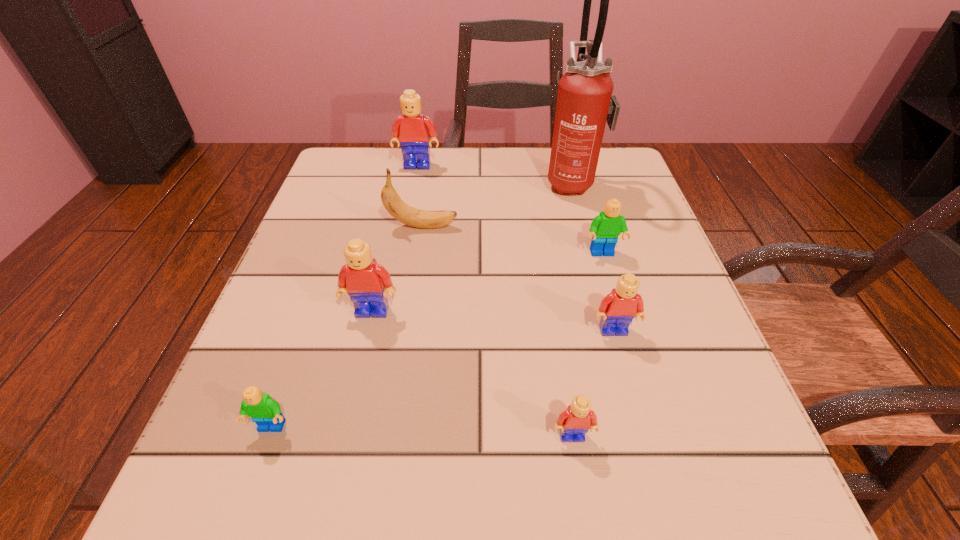
Identify the location of the fourth closest Lego relative to the banana. [618, 309].

Locate an element on the screen. The image size is (960, 540). yellow Lego that is the second closest to the leftmost Lego is located at coordinates (574, 422).

You are a GUI agent. You are given a task and a screenshot of the screen. Output one action in this format:
    pyautogui.click(x=<x>, y=<y>)
    Task: Click on the yellow Lego that stands as the closest to the farther green Lego
    The height and width of the screenshot is (540, 960).
    Given the screenshot: What is the action you would take?
    pyautogui.click(x=618, y=309)

The height and width of the screenshot is (540, 960). Identify the location of free point that satisfies the following two spatial constraints: 1. at the nozzle of the fire extinguisher; 2. on the front-facing side of the second biggest yellow Lego. (606, 310).